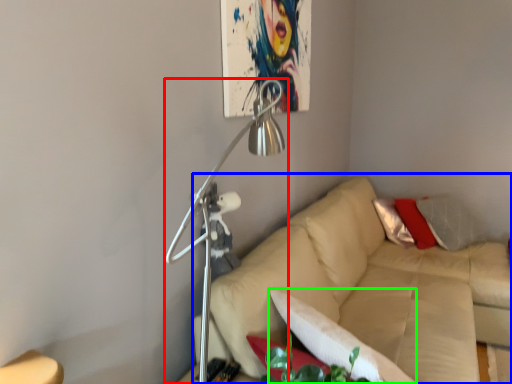
Question: Which object is positioned farthest from lamp (highlighted by a red box)? Select from studio couch (highlighted by a blue box) and pillow (highlighted by a green box).

Choices:
 (A) studio couch
 (B) pillow

Answer: (A)